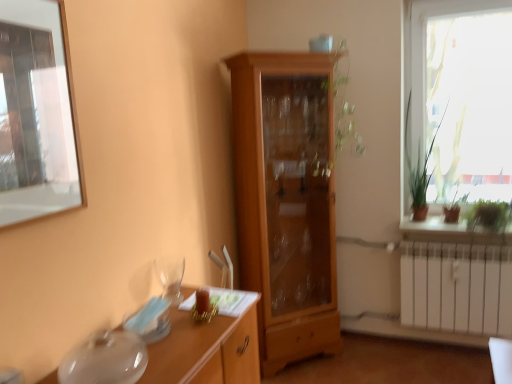
Identify the location of free spot above transparent glass desk at lower left (from a real-world perspective). Image resolution: width=512 pixels, height=384 pixels. (184, 330).